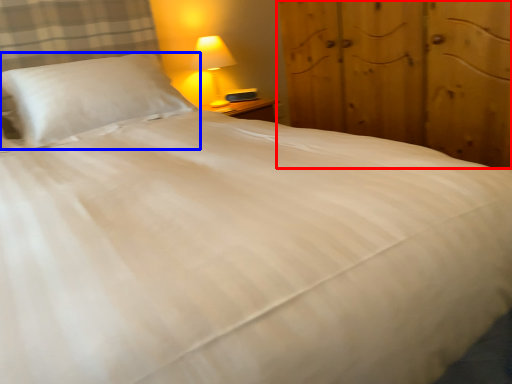
Question: Which of the following is the closest to the observer, dresser (highlighted by a red box) or pillow (highlighted by a blue box)?

Choices:
 (A) dresser
 (B) pillow

Answer: (A)